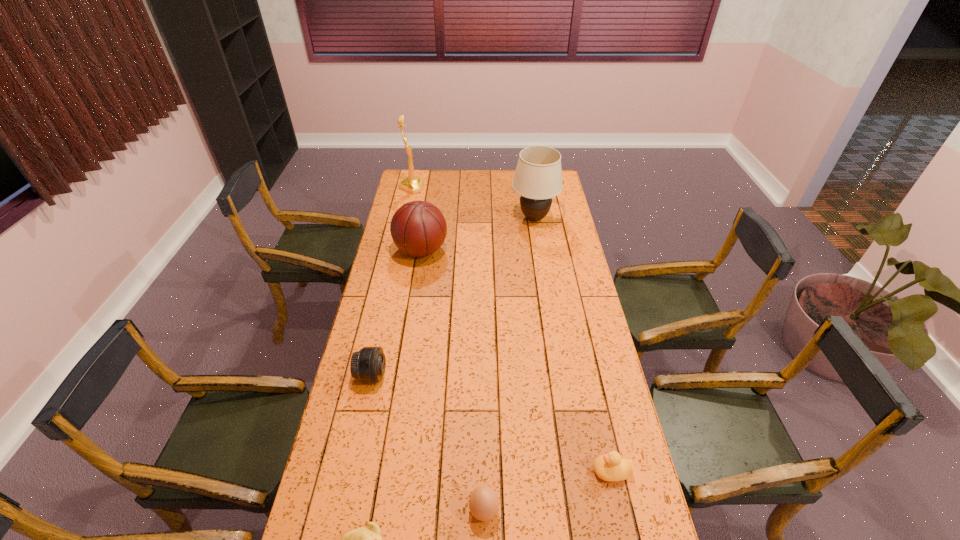
Where is `award`? This screenshot has width=960, height=540. award is located at coordinates (412, 184).

The image size is (960, 540). Find the location of `lampshade`. lampshade is located at coordinates pyautogui.click(x=538, y=177).

You are a GUI agent. You are given a task and a screenshot of the screen. Output one action in this format:
    pyautogui.click(x=<x>, y=<y>)
    Task: Click on the basketball
    The width and height of the screenshot is (960, 540).
    Given the screenshot: What is the action you would take?
    pyautogui.click(x=418, y=228)

At what (x,y) coordinates should I click in order to perform the action: click on the fifth shortest object. Please return your answer as a coordinate pair (x, y). The image size is (960, 540). Looking at the image, I should click on (418, 228).

Find the location of a particular element. the fourth nearest object is located at coordinates (368, 365).

Identify the location of boiled egg. This screenshot has height=540, width=960. (484, 502).

At what (x,y) coordinates should I click in order to perform the action: click on duck. Please return your answer as a coordinate pair (x, y). Looking at the image, I should click on (611, 467).

Find the location of a particular element. blank area located 0.110m on the front-facing side of the award is located at coordinates (444, 187).

The image size is (960, 540). Find the location of `vacant space located 0.330m on the back of the sixth nearest object`. vacant space located 0.330m on the back of the sixth nearest object is located at coordinates (527, 173).

Locate an element on the screen. free space located on the right of the basketball is located at coordinates (462, 251).